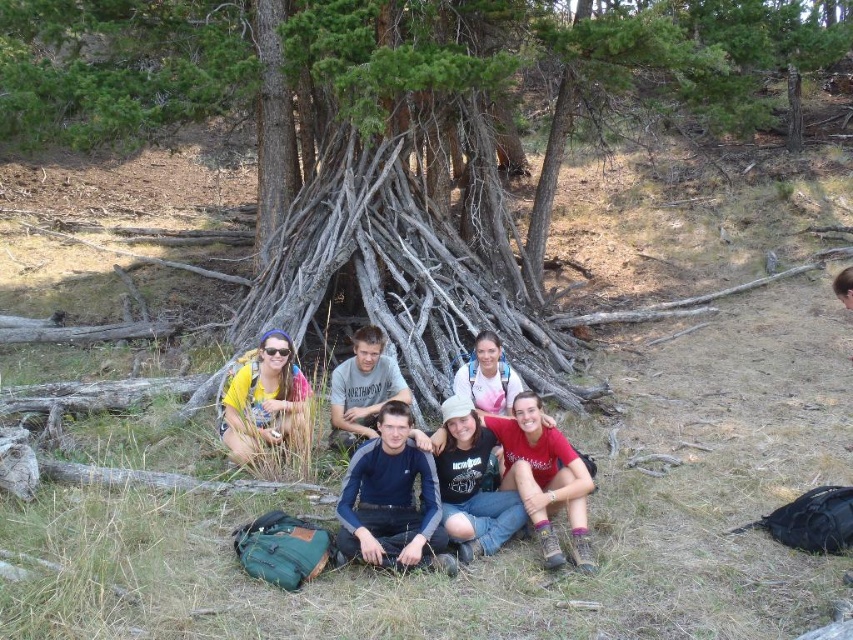
Does dark blue fleece at center appear over dark blue sweater at center?

Actually, dark blue fleece at center is below dark blue sweater at center.

Does dark blue fleece at center appear under dark blue sweater at center?

Correct, dark blue fleece at center is located below dark blue sweater at center.

The width and height of the screenshot is (853, 640). What do you see at coordinates (390, 499) in the screenshot? I see `dark blue fleece at center` at bounding box center [390, 499].

Where is `dark blue fleece at center`? The width and height of the screenshot is (853, 640). dark blue fleece at center is located at coordinates (390, 499).

Describe the element at coordinates (390, 499) in the screenshot. I see `dark blue fleece at center` at that location.

Is dark blue fleece at center closer to camera compared to black cotton shirt at center?

Yes, dark blue fleece at center is in front of black cotton shirt at center.

I want to click on dark blue fleece at center, so click(x=390, y=499).

Between black cotton shirt at center and dark blue sweater at center, which one appears on the left side from the viewer's perspective?

dark blue sweater at center is more to the left.

Between point (515, 522) and point (395, 372), which one is positioned behind?

The point (395, 372) is more distant.

Locate an element on the screen. The image size is (853, 640). black cotton shirt at center is located at coordinates (471, 484).